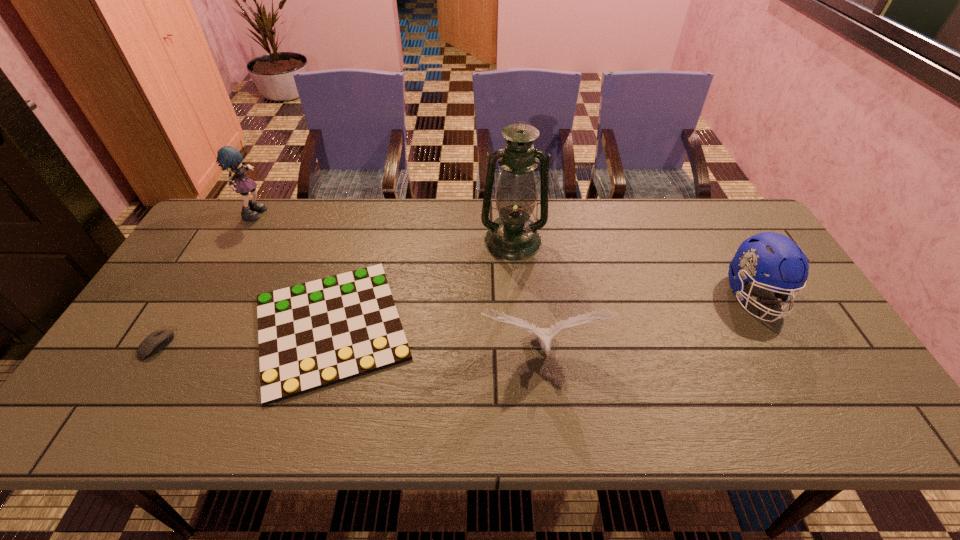
Where is `the tallest object`? the tallest object is located at coordinates (513, 236).

Image resolution: width=960 pixels, height=540 pixels. I want to click on oil lamp, so click(513, 236).

You are a GUI agent. You are given a task and a screenshot of the screen. Output one action in this format:
    pyautogui.click(x=<x>, y=<y>)
    Task: Click on the rag doll
    The height and width of the screenshot is (540, 960).
    Given the screenshot: What is the action you would take?
    pyautogui.click(x=228, y=157)

Identify the location of the farthest object. The width and height of the screenshot is (960, 540). (228, 157).

Identify the location of the rightmost object. (771, 253).

Where is `gull`? gull is located at coordinates (545, 336).

Identify the location of the fifth tallest object. The width and height of the screenshot is (960, 540). (156, 341).

Locate an element on the screen. the fourth object from right to left is located at coordinates (311, 335).

Where is `the shortest object`? Image resolution: width=960 pixels, height=540 pixels. the shortest object is located at coordinates (311, 335).

You are a GUI agent. You are given a task and a screenshot of the screen. Output one action in this format:
    pyautogui.click(x=<x>, y=<y>)
    Task: Click on the free location located 0.180m on the left of the tallest object
    The image size is (960, 540).
    Given the screenshot: What is the action you would take?
    pyautogui.click(x=423, y=240)